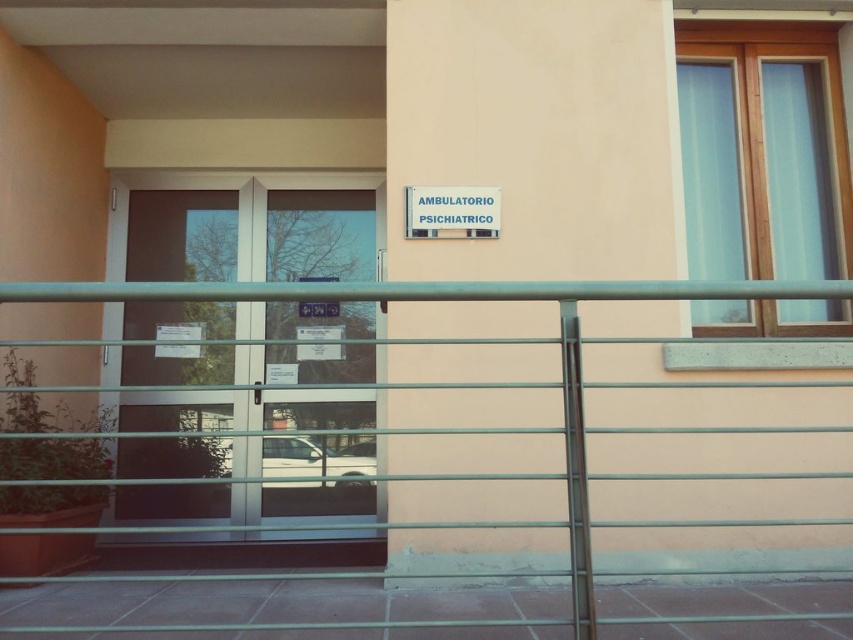
Question: Among these objects, which one is farthest from the camera?

Choices:
 (A) white plastic sign at upper center
 (B) metallic silver fence at center
 (C) transparent glass door at center

Answer: (C)

Question: Which object is farther from the camera taking this photo?

Choices:
 (A) metallic silver fence at center
 (B) white plastic sign at upper center
 (C) transparent glass door at center

Answer: (C)

Question: Can you confirm if transparent glass door at center is positioned below metallic silver fence at center?

Choices:
 (A) no
 (B) yes

Answer: (B)

Question: Does transparent glass door at center appear under white plastic sign at upper center?

Choices:
 (A) yes
 (B) no

Answer: (A)

Question: Considering the real-world distances, which object is closest to the transparent glass door at center?

Choices:
 (A) white plastic sign at upper center
 (B) metallic silver fence at center

Answer: (A)

Question: Is metallic silver fence at center to the left of white plastic sign at upper center from the viewer's perspective?

Choices:
 (A) no
 (B) yes

Answer: (B)